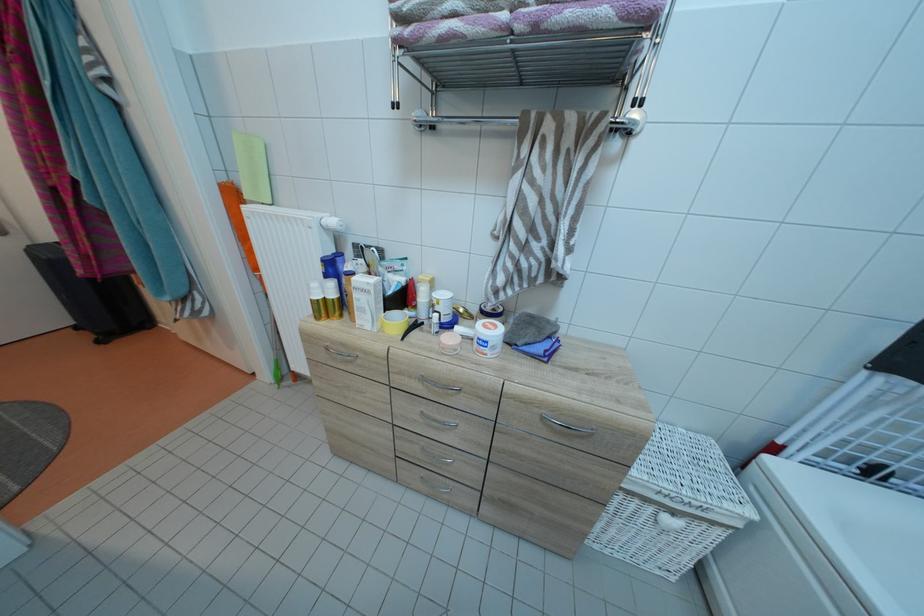
Where would you unscrew the small pink jar? Please return your answer as a coordinate pair (x, y).

(450, 342)